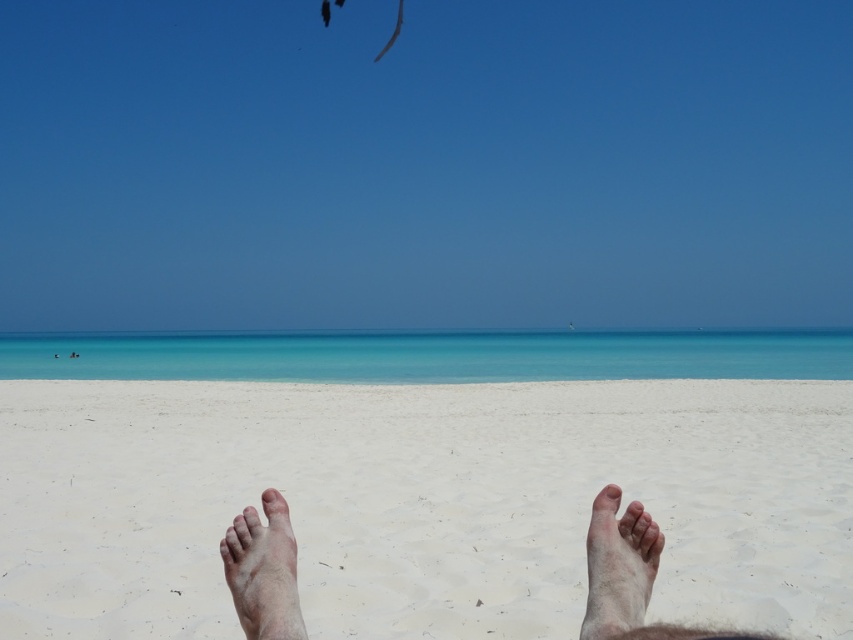
Question: Which object appears closest to the camera in this image?

Choices:
 (A) pale skin foot at lower right
 (B) pale skin toe at lower center
 (C) white sandy feet at center
 (D) dry skin foot at lower left

Answer: (D)

Question: Can you confirm if white sandy feet at center is positioned to the right of pale skin foot at lower right?

Choices:
 (A) no
 (B) yes

Answer: (B)

Question: Considering the relative positions of pale skin foot at lower right and pale skin toe at lower center in the image provided, where is pale skin foot at lower right located with respect to pale skin toe at lower center?

Choices:
 (A) below
 (B) above

Answer: (A)

Question: Which of these objects is positioned closest to the pale skin toe at center?

Choices:
 (A) dry skin foot at lower left
 (B) pale skin toe at lower center
 (C) skinny bare feet at center
 (D) pale skin foot at lower right

Answer: (A)

Question: Which object is the farthest from the skinny bare feet at center?

Choices:
 (A) pale skin toe at center
 (B) dry skin foot at lower left
 (C) white sandy feet at center
 (D) pale skin toe at lower center

Answer: (C)

Question: Can you confirm if white sandy feet at center is thinner than skinny bare feet at center?

Choices:
 (A) yes
 (B) no

Answer: (B)